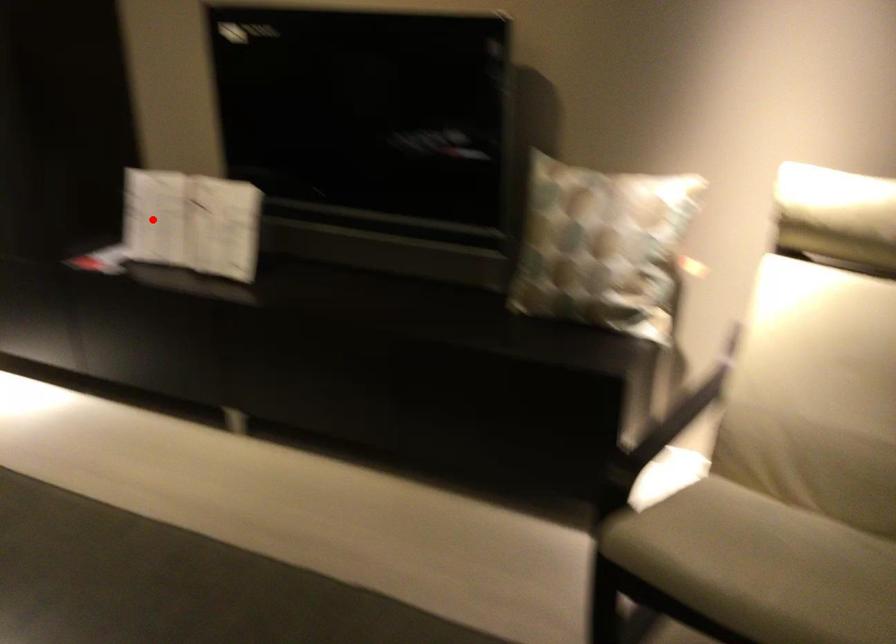
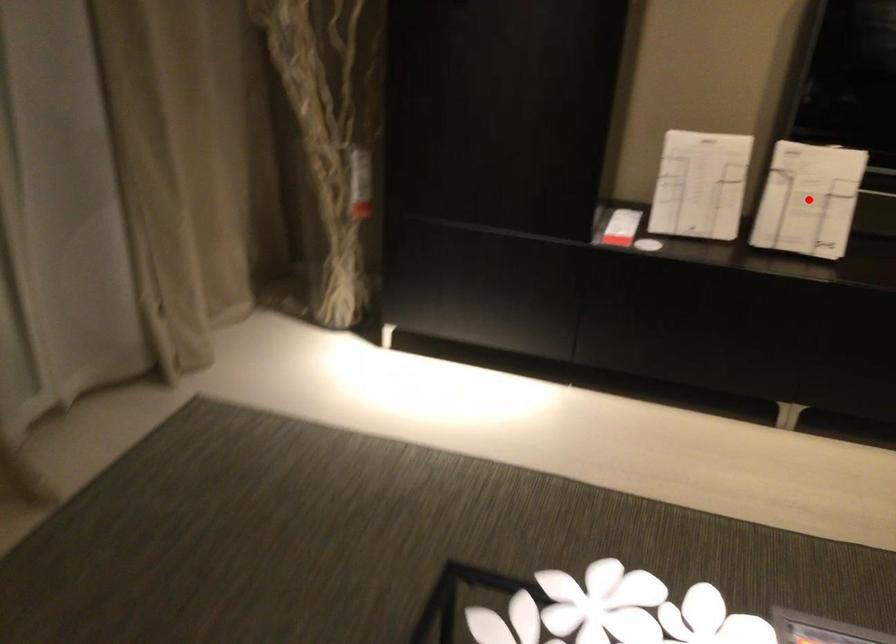
I am providing you with two images of the same scene from different viewpoints. A red point is marked on the first image and another point is marked on the second image. Is the marked point in image1 the same physical position as the marked point in image2?

No